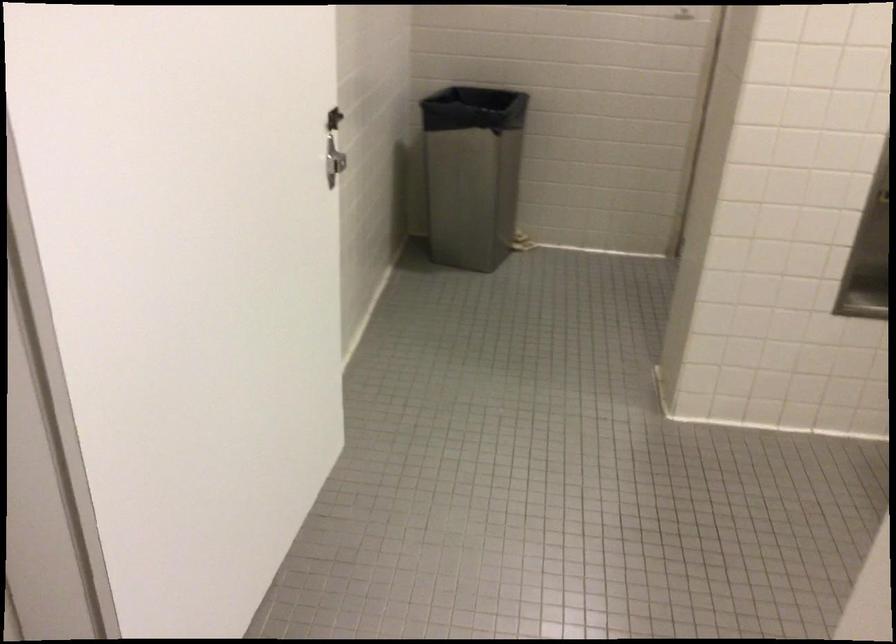
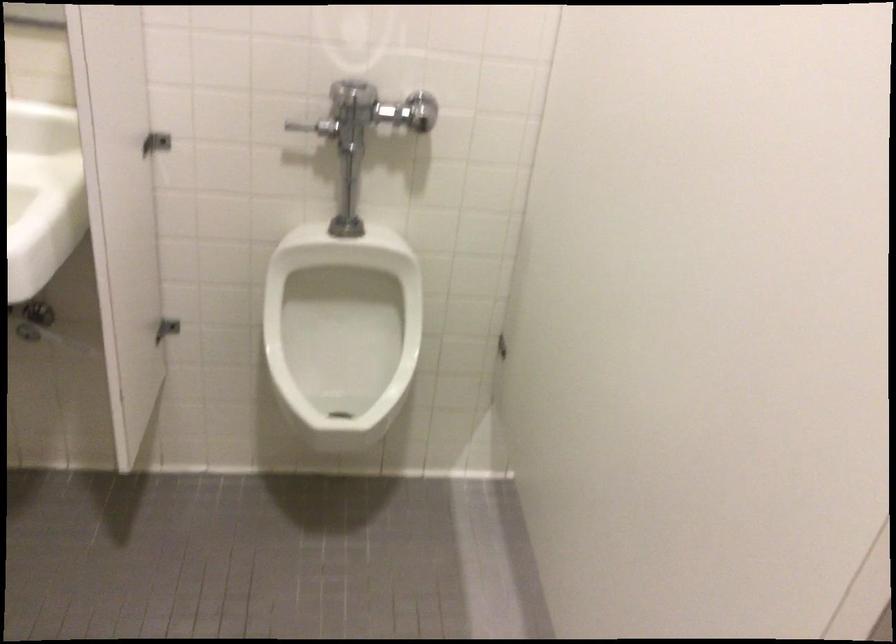
The first image is from the beginning of the video and the second image is from the end. How did the camera likely rotate when shooting the video?

The rotation direction of the camera is right-down.